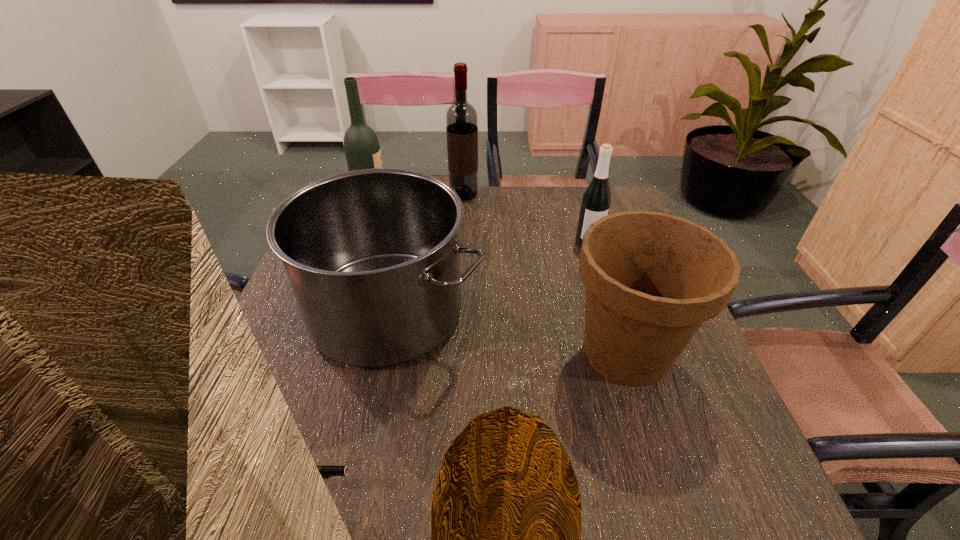
The height and width of the screenshot is (540, 960). Find the location of `the second wine bottle from left to right`. the second wine bottle from left to right is located at coordinates (461, 117).

Locate an element on the screen. the leftmost wine bottle is located at coordinates (362, 150).

You are a GUI agent. You are given a task and a screenshot of the screen. Output one action in this format:
    pyautogui.click(x=<x>, y=<y>)
    Task: Click on the nearest wine bottle
    
    Given the screenshot: What is the action you would take?
    pyautogui.click(x=596, y=200)

This screenshot has width=960, height=540. I want to click on the rightmost wine bottle, so [x=596, y=200].

Where is `saucepan`? This screenshot has width=960, height=540. saucepan is located at coordinates (372, 255).

Find the location of a particular element. The image size is (960, 540). flowerpot is located at coordinates (652, 279).

This screenshot has width=960, height=540. Find the location of `the shortest object`. the shortest object is located at coordinates (326, 471).

Where is `pistol`? The height and width of the screenshot is (540, 960). pistol is located at coordinates (326, 471).

You are a GUI agent. You are given a task and a screenshot of the screen. Output one action in this format:
    pyautogui.click(x=<x>, y=<y>)
    Task: Click on the free region located on the left of the second wine bottle from right to left
    This screenshot has width=960, height=540.
    Given the screenshot: What is the action you would take?
    pyautogui.click(x=412, y=194)

In order to click on free space located on the labeled side of the leftmost wine bottle in this screenshot , I will do `click(432, 210)`.